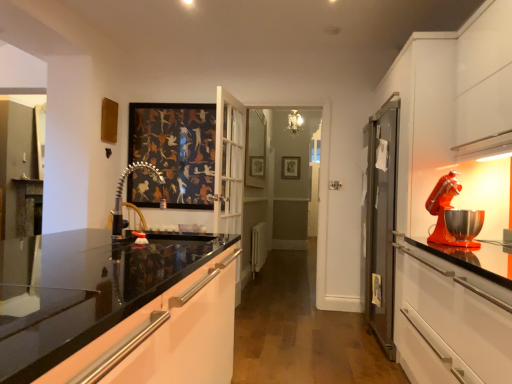
Question: Does wooden picture frame at center turn towards white plastic radiator at center?

Choices:
 (A) no
 (B) yes

Answer: (B)

Question: Considering the relative positions of wooden picture frame at center and white plastic radiator at center in the image provided, is wooden picture frame at center to the left of white plastic radiator at center from the viewer's perspective?

Choices:
 (A) yes
 (B) no

Answer: (B)

Question: Would you say wooden picture frame at center contains white plastic radiator at center?

Choices:
 (A) yes
 (B) no

Answer: (B)

Question: From the image's perspective, is wooden picture frame at center on top of white plastic radiator at center?

Choices:
 (A) yes
 (B) no

Answer: (A)

Question: Can we say wooden picture frame at center lies outside white plastic radiator at center?

Choices:
 (A) no
 (B) yes

Answer: (B)

Question: Based on their positions, is polished chrome faucet at center located to the left or right of glossy white cabinet at center?

Choices:
 (A) right
 (B) left

Answer: (A)

Question: In terms of height, does polished chrome faucet at center look taller or shorter compared to glossy white cabinet at center?

Choices:
 (A) short
 (B) tall

Answer: (A)

Question: Is point (163, 180) closer or farther from the camera than point (193, 359)?

Choices:
 (A) closer
 (B) farther

Answer: (B)

Question: Considering the positions of polished chrome faucet at center and glossy white cabinet at center in the image, is polished chrome faucet at center bigger or smaller than glossy white cabinet at center?

Choices:
 (A) big
 (B) small

Answer: (B)

Question: In terms of height, does wooden picture frame at center look taller or shorter compared to white plastic radiator at center?

Choices:
 (A) tall
 (B) short

Answer: (B)

Question: Which is correct: wooden picture frame at center is inside white plastic radiator at center, or outside of it?

Choices:
 (A) inside
 (B) outside

Answer: (B)

Question: Considering the positions of wooden picture frame at center and white plastic radiator at center in the image, is wooden picture frame at center bigger or smaller than white plastic radiator at center?

Choices:
 (A) big
 (B) small

Answer: (B)

Question: From the image's perspective, is wooden picture frame at center above or below white plastic radiator at center?

Choices:
 (A) above
 (B) below

Answer: (A)

Question: Would you say polished chrome faucet at center is to the left or to the right of shiny orange mixer at right in the picture?

Choices:
 (A) right
 (B) left

Answer: (B)

Question: Is polished chrome faucet at center taller or shorter than shiny orange mixer at right?

Choices:
 (A) short
 (B) tall

Answer: (A)